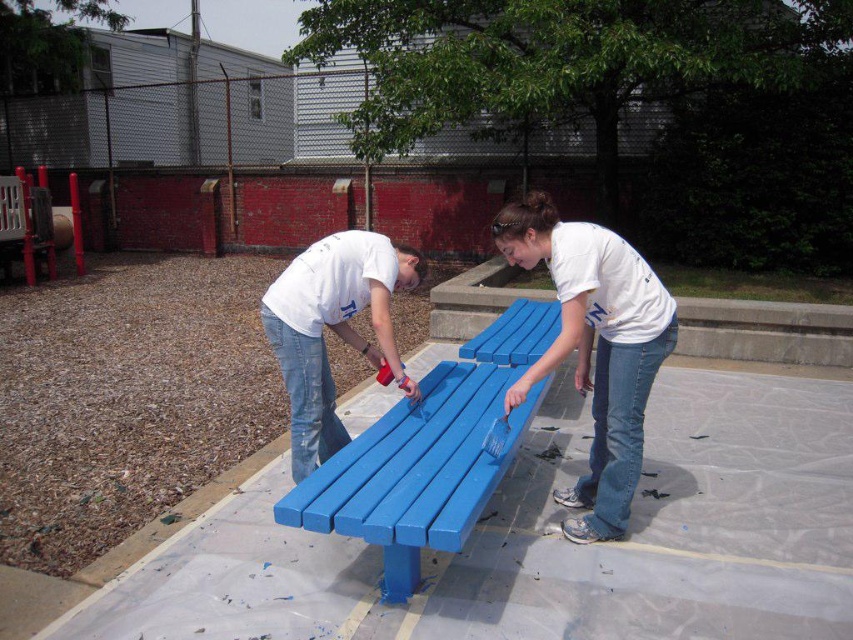
You are standing in front of the scene and want to paint the matte plastic bench at center. If you have a paintbrush that can reach 2 meters, can you comfortably reach the bench without moving closer?

The matte plastic bench at center is 2.28 meters away from the viewer. Since your paintbrush can only reach 2 meters, you cannot comfortably reach the bench without moving closer.

You are organizing a community event where participants will paint benches. You have two benches available for painting, the matte plastic bench at center and the blue painted wood bench at center. Which bench should you choose if you need a smaller one for the event?

The blue painted wood bench at center is smaller than the matte plastic bench at center, so you should choose the blue painted wood bench at center for the event.